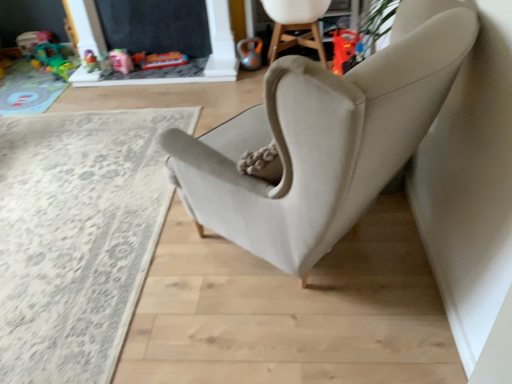
Question: From the image's perspective, does matte pink toy at upper left, arranged as the third toy when viewed from the right, appear lower than translucent plastic toy at upper left, which is the 2th toy from left to right?

Choices:
 (A) no
 (B) yes

Answer: (B)

Question: Considering the relative sizes of matte pink toy at upper left, positioned as the 3th toy in left-to-right order, and translucent plastic toy at upper left, which is the fourth toy from right to left, in the image provided, is matte pink toy at upper left, positioned as the 3th toy in left-to-right order, shorter than translucent plastic toy at upper left, which is the fourth toy from right to left,?

Choices:
 (A) no
 (B) yes

Answer: (A)

Question: Considering the relative sizes of matte pink toy at upper left, positioned as the 3th toy in left-to-right order, and translucent plastic toy at upper left, which is the fourth toy from right to left, in the image provided, is matte pink toy at upper left, positioned as the 3th toy in left-to-right order, smaller than translucent plastic toy at upper left, which is the fourth toy from right to left,?

Choices:
 (A) yes
 (B) no

Answer: (A)

Question: Can you confirm if matte pink toy at upper left, positioned as the 3th toy in left-to-right order, is bigger than translucent plastic toy at upper left, which is the fourth toy from right to left?

Choices:
 (A) yes
 (B) no

Answer: (B)

Question: Is matte pink toy at upper left, arranged as the third toy when viewed from the right, far from translucent plastic toy at upper left, which is the fourth toy from right to left?

Choices:
 (A) yes
 (B) no

Answer: (B)

Question: In terms of width, does matte pink toy at upper left, positioned as the 3th toy in left-to-right order, look wider or thinner when compared to beige carpet at lower left?

Choices:
 (A) wide
 (B) thin

Answer: (B)

Question: Is point (112, 66) positioned closer to the camera than point (62, 140)?

Choices:
 (A) closer
 (B) farther

Answer: (B)

Question: From the image's perspective, is matte pink toy at upper left, arranged as the third toy when viewed from the right, positioned above or below beige carpet at lower left?

Choices:
 (A) below
 (B) above

Answer: (B)

Question: Would you say matte pink toy at upper left, positioned as the 3th toy in left-to-right order, is to the left or to the right of beige carpet at lower left in the picture?

Choices:
 (A) right
 (B) left

Answer: (A)

Question: Is point (88, 379) closer or farther from the camera than point (218, 38)?

Choices:
 (A) closer
 (B) farther

Answer: (A)

Question: Would you say beige carpet at lower left is inside or outside black chalkboard at upper center?

Choices:
 (A) inside
 (B) outside

Answer: (B)

Question: Considering the positions of beige carpet at lower left and black chalkboard at upper center in the image, is beige carpet at lower left bigger or smaller than black chalkboard at upper center?

Choices:
 (A) small
 (B) big

Answer: (B)

Question: From the image's perspective, is beige carpet at lower left above or below black chalkboard at upper center?

Choices:
 (A) below
 (B) above

Answer: (A)

Question: From a real-world perspective, relative to black chalkboard at upper center, is orange metallic kettlebell at upper center, which ranks as the first toy in right-to-left order, vertically above or below?

Choices:
 (A) above
 (B) below

Answer: (B)

Question: Is orange metallic kettlebell at upper center, which ranks as the first toy in right-to-left order, taller or shorter than black chalkboard at upper center?

Choices:
 (A) tall
 (B) short

Answer: (B)